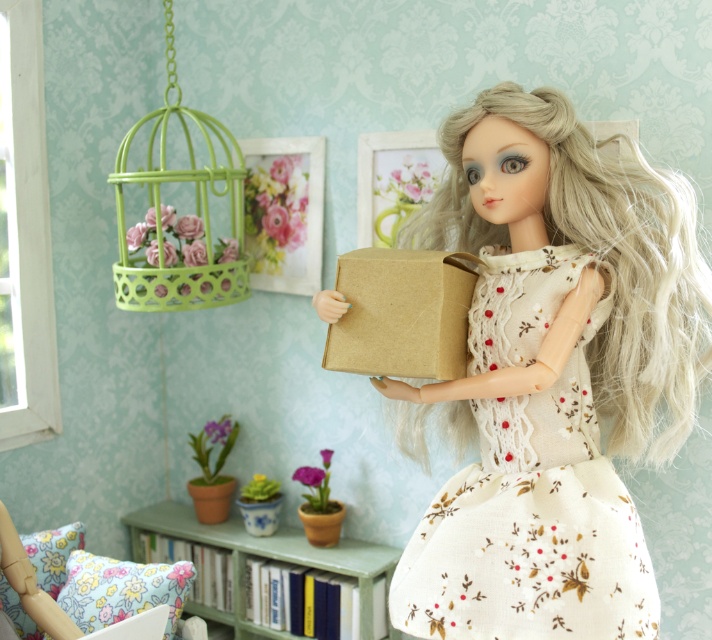
Is green wire birdcage at upper left to the left of brown/kraft paper box at center from the viewer's perspective?

Correct, you'll find green wire birdcage at upper left to the left of brown/kraft paper box at center.

Is point (157, 262) positioned behind point (387, 291)?

Yes, it is behind point (387, 291).

Is point (214, 166) positioned before point (330, 333)?

No, (214, 166) is further to viewer.

Where is `green wire birdcage at upper left`? Image resolution: width=712 pixels, height=640 pixels. green wire birdcage at upper left is located at coordinates (179, 216).

Between green wire birdcage at upper left and green painted wood bookshelf at lower center, which one appears on the right side from the viewer's perspective?

green painted wood bookshelf at lower center is more to the right.

Which is in front, point (120, 227) or point (179, 525)?

Positioned in front is point (120, 227).

Who is more forward, (189, 221) or (240, 573)?

Point (189, 221)

Where is `green wire birdcage at upper left`? green wire birdcage at upper left is located at coordinates (179, 216).

Does green wire birdcage at upper left appear on the right side of green matte plant pot at lower left?

Incorrect, green wire birdcage at upper left is not on the right side of green matte plant pot at lower left.

Who is positioned more to the right, green wire birdcage at upper left or green matte plant pot at lower left?

green matte plant pot at lower left

Which is in front, point (192, 243) or point (204, 456)?

Point (192, 243) is more forward.

Where is `green wire birdcage at upper left`? The height and width of the screenshot is (640, 712). green wire birdcage at upper left is located at coordinates (179, 216).